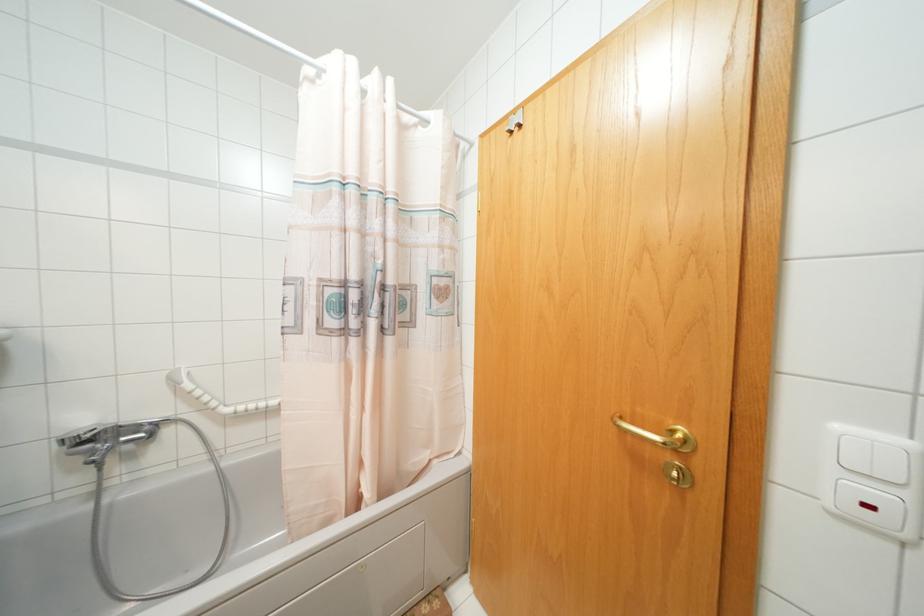
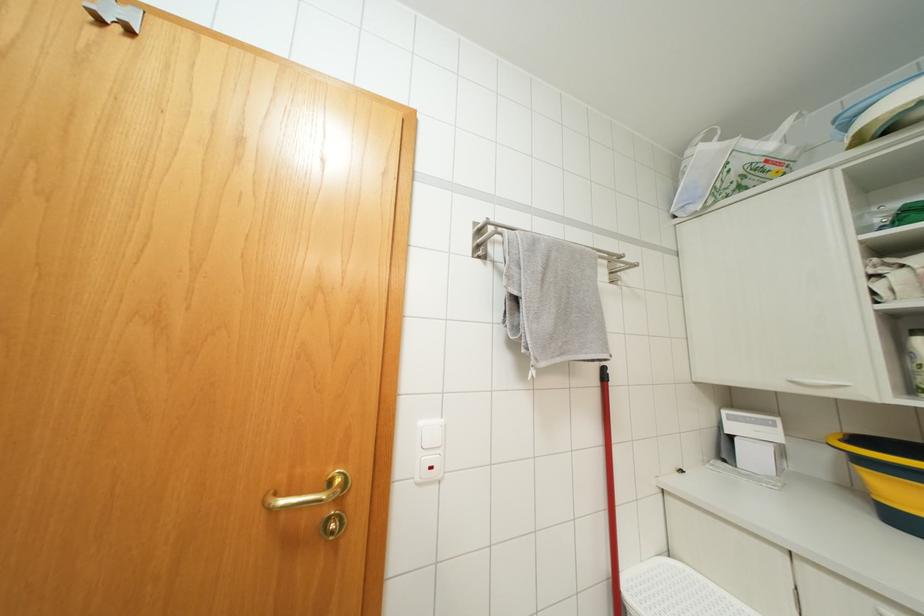
Question: The camera is either moving clockwise (left) or counter-clockwise (right) around the object. The first image is from the beginning of the video and the second image is from the end. Is the camera moving left or right when shooting the video?

Choices:
 (A) Left
 (B) Right

Answer: (A)